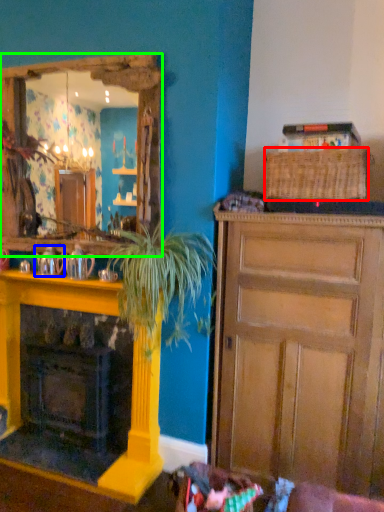
Question: Which object is the closest to the picnic basket (highlighted by a red box)? Choose among these: teapot (highlighted by a blue box) or cabinetry (highlighted by a green box).

Choices:
 (A) teapot
 (B) cabinetry

Answer: (B)